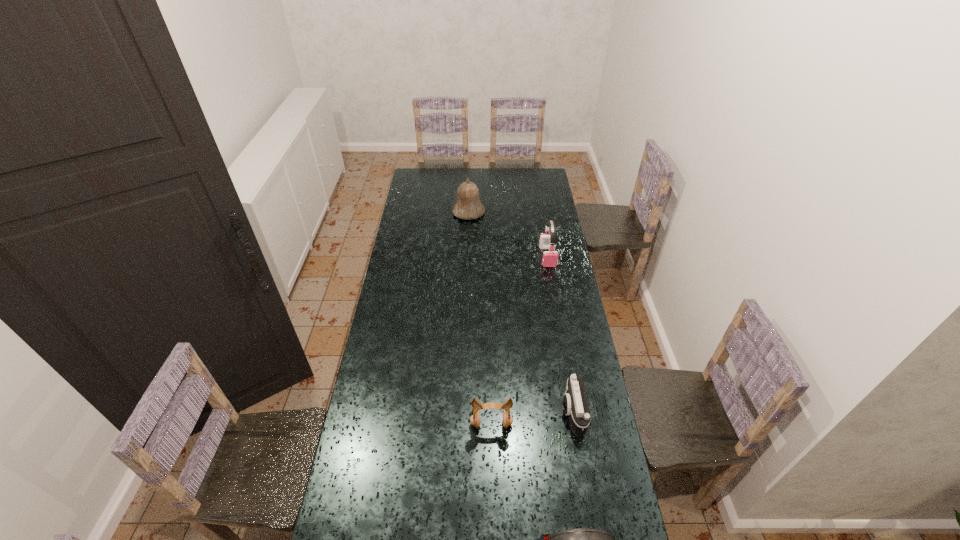
At what (x,y) coordinates should I click in order to perform the action: click on bell. Please return your answer as a coordinate pair (x, y). Looking at the image, I should click on (468, 205).

Where is `the fourth nearest object`? This screenshot has width=960, height=540. the fourth nearest object is located at coordinates (550, 258).

Identify the location of the leftmost earphone. The image size is (960, 540). (475, 418).

The image size is (960, 540). What are the coordinates of `camera` in the screenshot? It's located at (575, 403).

Find the location of a particular element. Image resolution: width=960 pixels, height=540 pixels. vacant area located on the left of the farthest object is located at coordinates (437, 212).

Where is `free spot located 0.130m on the outer surface of the fourth nearest object`? Image resolution: width=960 pixels, height=540 pixels. free spot located 0.130m on the outer surface of the fourth nearest object is located at coordinates (553, 286).

Where is `vacant space located 0.150m on the front-facing side of the second nearest earphone`? This screenshot has height=540, width=960. vacant space located 0.150m on the front-facing side of the second nearest earphone is located at coordinates (492, 475).

Identify the location of vacant space located 0.050m on the front lens of the shortest object. (547, 412).

Identify the location of free location located 0.050m on the front lens of the shortest object. (547, 412).

Image resolution: width=960 pixels, height=540 pixels. Identify the location of vacant region located on the front lens of the shortest object. (527, 412).